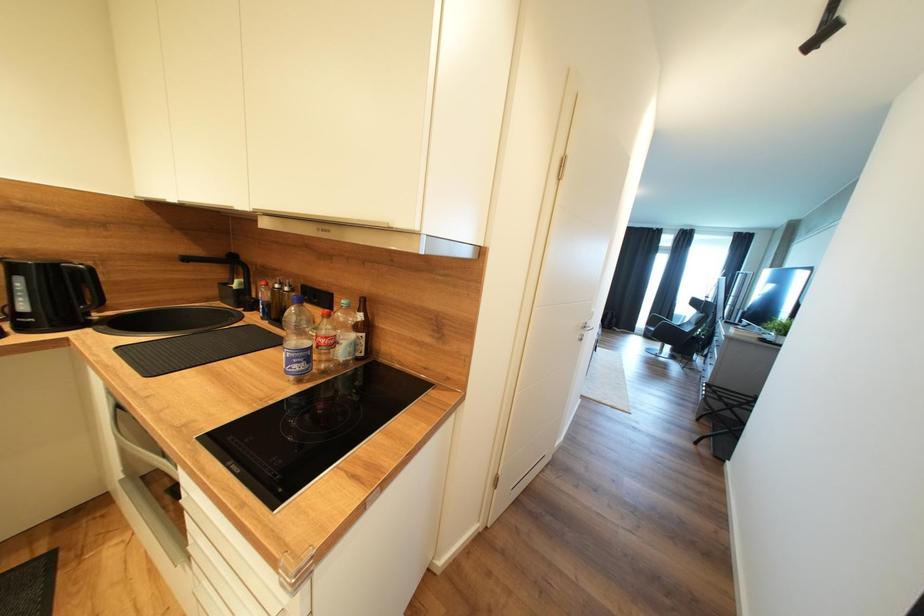
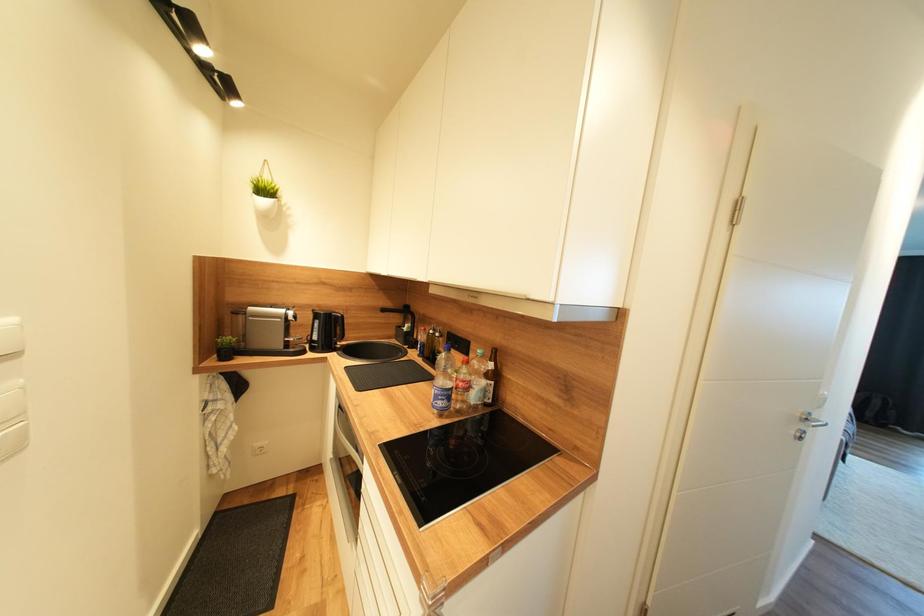
Question: What movement of the cameraman would produce the second image?

Choices:
 (A) Left
 (B) Right
 (C) Forward
 (D) Backward

Answer: (D)